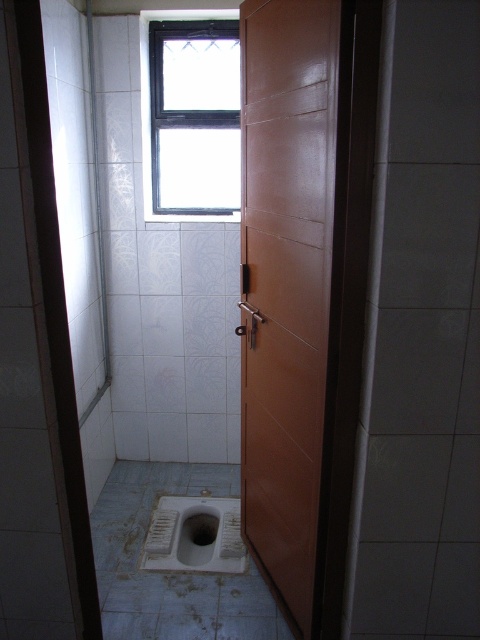
Question: Which point is closer to the camera?

Choices:
 (A) (302, 509)
 (B) (213, 90)

Answer: (A)

Question: Does glossy wood door at center have a smaller size compared to white matte toilet bowl at center?

Choices:
 (A) no
 (B) yes

Answer: (A)

Question: Considering the real-world distances, which object is closest to the clear glass window at upper center?

Choices:
 (A) glossy wood door at center
 (B) white matte toilet bowl at center

Answer: (A)

Question: Which point is farther to the camera?

Choices:
 (A) white matte toilet bowl at center
 (B) glossy wood door at center
 (C) clear glass window at upper center

Answer: (C)

Question: Where is glossy wood door at center located in relation to clear glass window at upper center in the image?

Choices:
 (A) right
 (B) left

Answer: (A)

Question: Does glossy wood door at center have a lesser width compared to white matte toilet bowl at center?

Choices:
 (A) yes
 (B) no

Answer: (A)